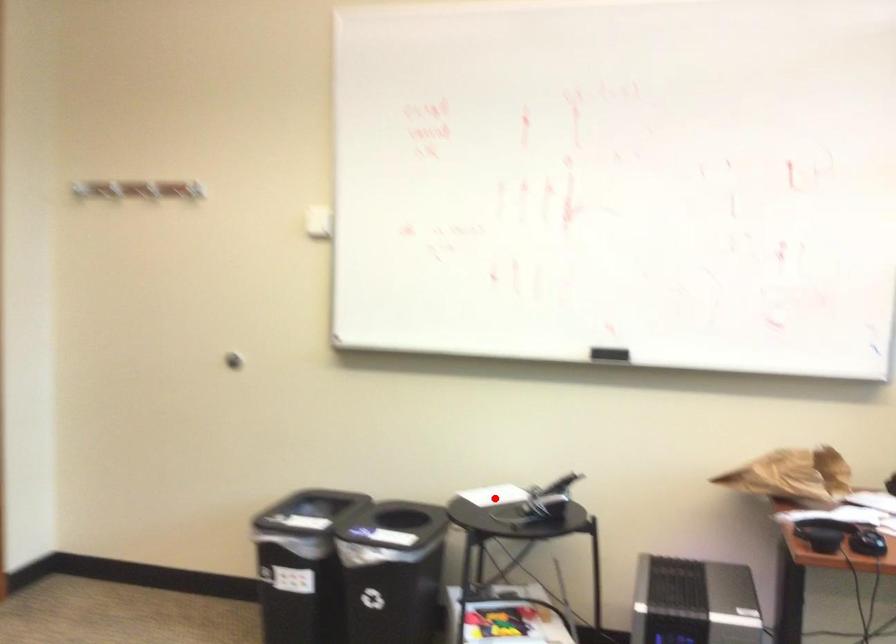
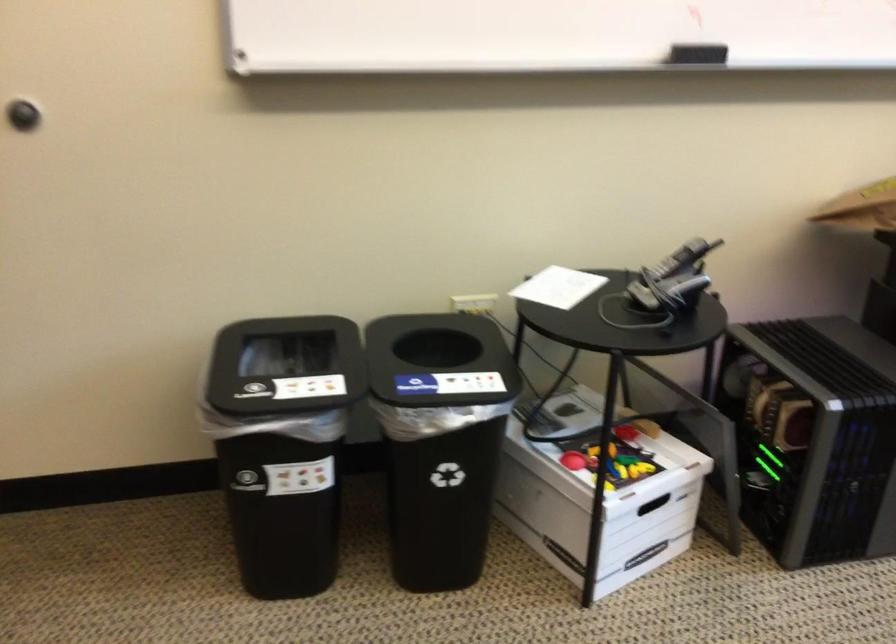
Question: A red point is marked in image1. In image2, is the corresponding 3D point closer to the camera or farther? Reply with the corresponding letter.

Choices:
 (A) The corresponding 3D point is closer.
 (B) The corresponding 3D point is farther.

Answer: (A)